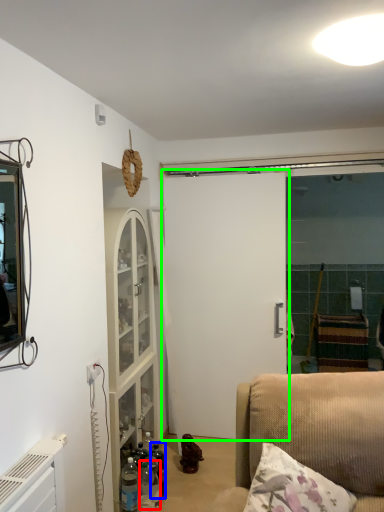
Question: Estimate the real-world distances between objects in this image. Which object is farther from bottle (highlighted by a red box), bottle (highlighted by a blue box) or door (highlighted by a green box)?

Choices:
 (A) bottle
 (B) door

Answer: (B)